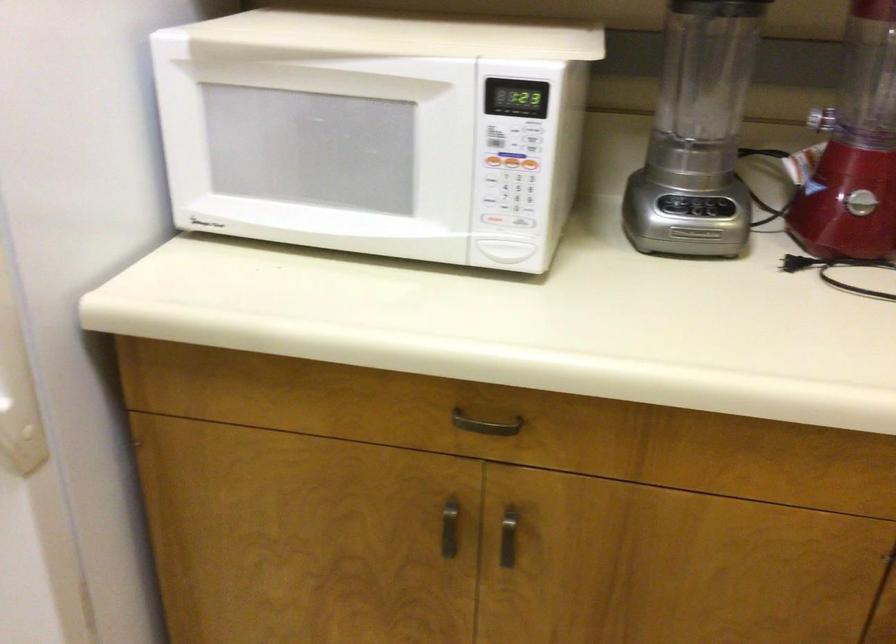
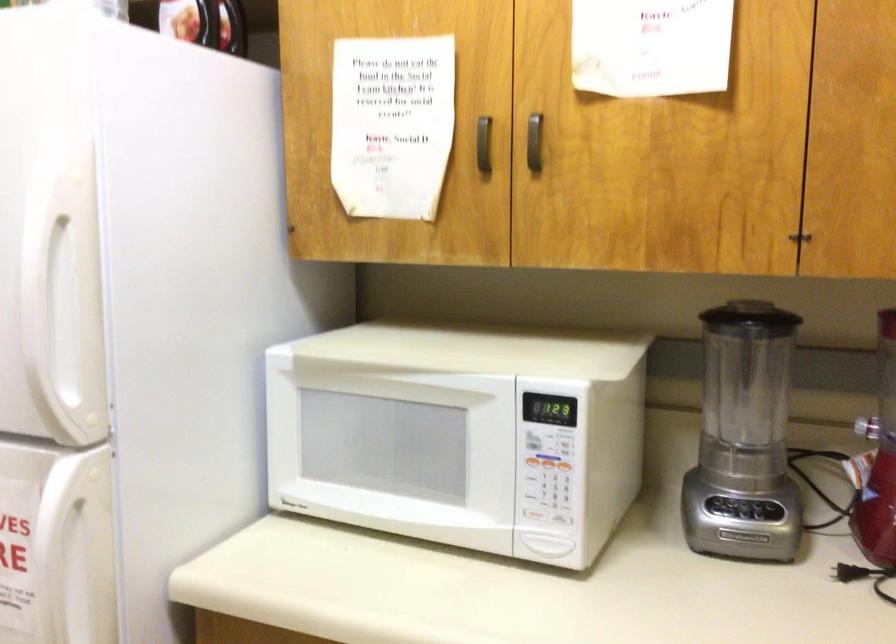
Locate, in the second image, the point that corresponds to pixel 695 207 in the first image.

(744, 512)